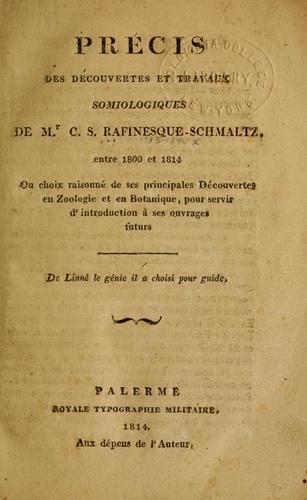
The width and height of the screenshot is (307, 500). Identify the location of yellow-ish paper. (278, 419).